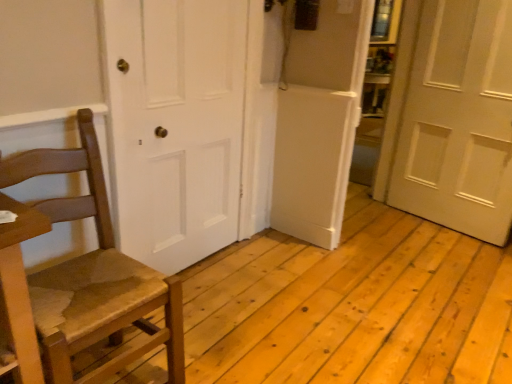
Identify the location of vacant area that is in front of white matte door at right, the second door in the left-to-right sequence. (446, 256).